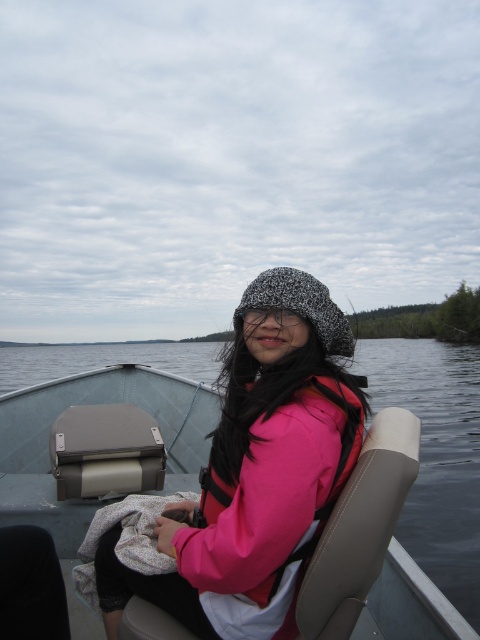
Does pink fleece jacket at center have a lesser width compared to pink fabric life jacket at center?

No.

Which of these two, pink fleece jacket at center or pink fabric life jacket at center, stands taller?

Standing taller between the two is pink fleece jacket at center.

This screenshot has width=480, height=640. What are the coordinates of `pink fleece jacket at center` in the screenshot? It's located at (257, 472).

Based on the photo, can you confirm if pink fleece jacket at center is bigger than speckled knit hat at center?

Correct, pink fleece jacket at center is larger in size than speckled knit hat at center.

Between point (304, 557) and point (247, 300), which one is positioned in front?

Positioned in front is point (304, 557).

Locate an element on the screen. The image size is (480, 640). pink fleece jacket at center is located at coordinates (257, 472).

In order to click on pink fleece jacket at center in this screenshot , I will do `click(257, 472)`.

How distant is pink fabric life jacket at center from speckled knit hat at center?

16.04 inches

Which is in front, point (210, 513) or point (310, 304)?

Point (310, 304) is more forward.

Is point (321, 480) closer to viewer compared to point (312, 300)?

That is True.

Image resolution: width=480 pixels, height=640 pixels. I want to click on pink fabric life jacket at center, so click(278, 492).